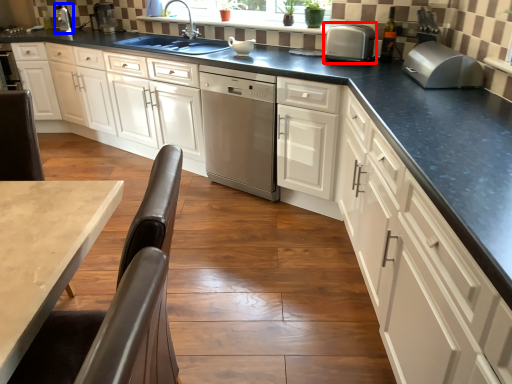
Question: Which of the following is the farthest to the observer, kitchen appliance (highlighted by a red box) or appliance (highlighted by a blue box)?

Choices:
 (A) kitchen appliance
 (B) appliance

Answer: (B)